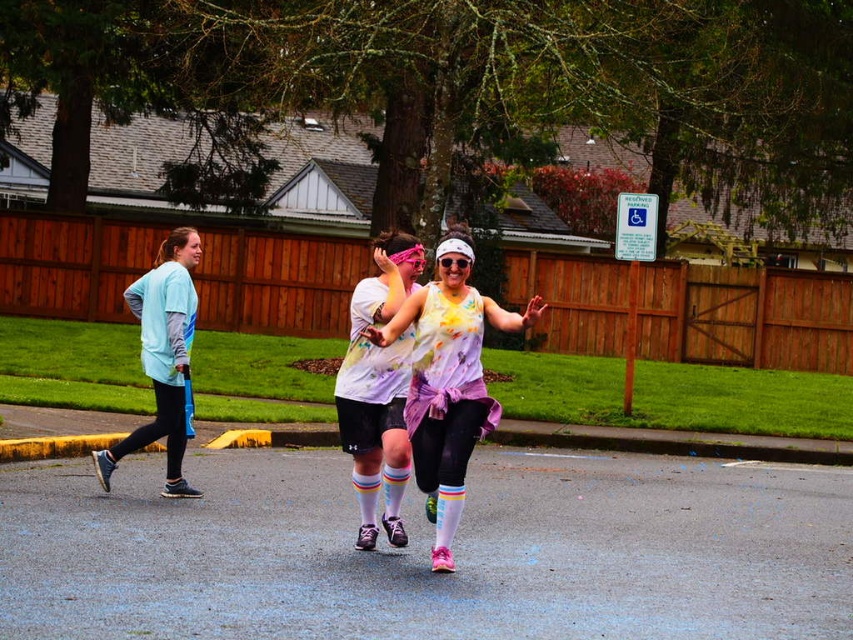
Question: Which point is closer to the camera?

Choices:
 (A) (161, 394)
 (B) (439, 269)

Answer: (B)

Question: Which of the following is the closest to the observer?

Choices:
 (A) light blue fabric shirt at left
 (B) rainbow-patterned leggings at center

Answer: (B)

Question: Estimate the real-world distances between objects in this image. Which object is farther from the light blue fabric shirt at left?

Choices:
 (A) rainbow striped socks at center
 (B) rainbow-patterned leggings at center

Answer: (B)

Question: Where is rainbow striped socks at center located in relation to light blue fabric shirt at left in the image?

Choices:
 (A) right
 (B) left

Answer: (A)

Question: Is the position of rainbow-patterned leggings at center more distant than that of rainbow striped socks at center?

Choices:
 (A) no
 (B) yes

Answer: (A)

Question: Can you confirm if rainbow-patterned leggings at center is thinner than light blue fabric shirt at left?

Choices:
 (A) yes
 (B) no

Answer: (B)